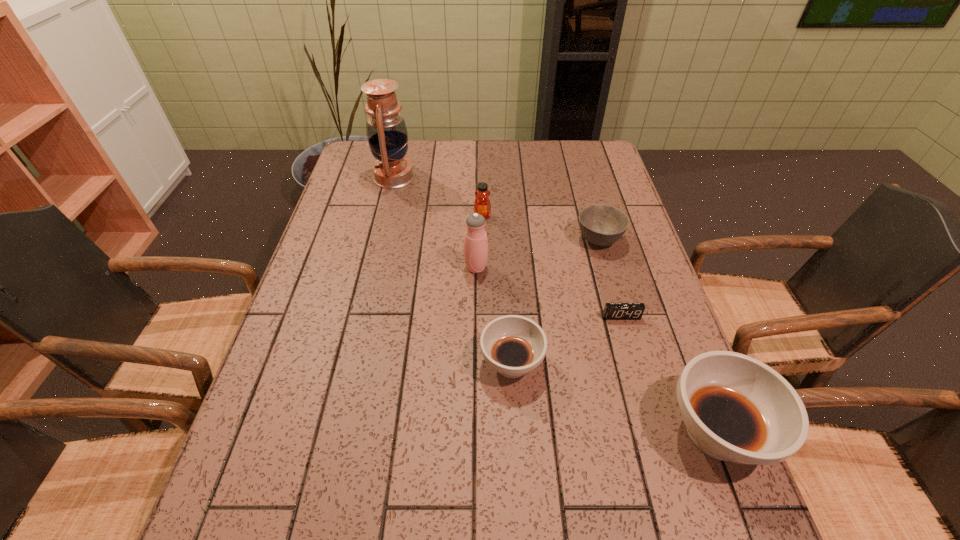
This screenshot has height=540, width=960. In order to click on thermos bottle in this screenshot , I will do `click(475, 242)`.

Locate an element on the screen. vacant space located on the left of the left soup bowl is located at coordinates (453, 363).

Image resolution: width=960 pixels, height=540 pixels. I want to click on free space located on the left of the taller soup bowl, so click(540, 431).

The image size is (960, 540). I want to click on free location located 0.270m on the front label of the honey, so click(x=483, y=287).

Identify the location of vacant space located 0.120m on the back of the bowl. (588, 201).

This screenshot has width=960, height=540. I want to click on vacant space located on the right of the tallest object, so click(x=535, y=177).

Where is `free space located on the front-facing side of the shortest object`? free space located on the front-facing side of the shortest object is located at coordinates (665, 475).

Image resolution: width=960 pixels, height=540 pixels. In order to click on free spot located on the left of the thermos bottle in this screenshot , I will do `click(348, 268)`.

Locate an element on the screen. object located at the far edge is located at coordinates (386, 130).

This screenshot has height=540, width=960. I want to click on object present at the near edge, so click(735, 408).